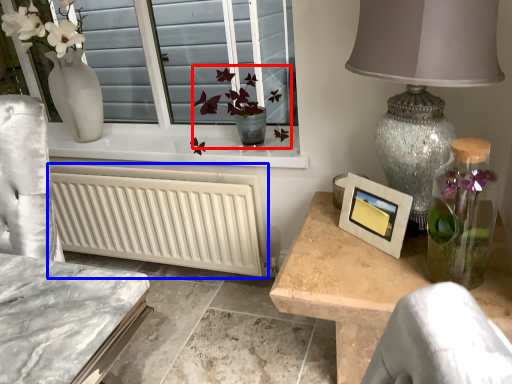
Question: Which point is further to the camera, floral arrangement (highlighted by a red box) or radiator (highlighted by a blue box)?

Choices:
 (A) floral arrangement
 (B) radiator

Answer: (B)